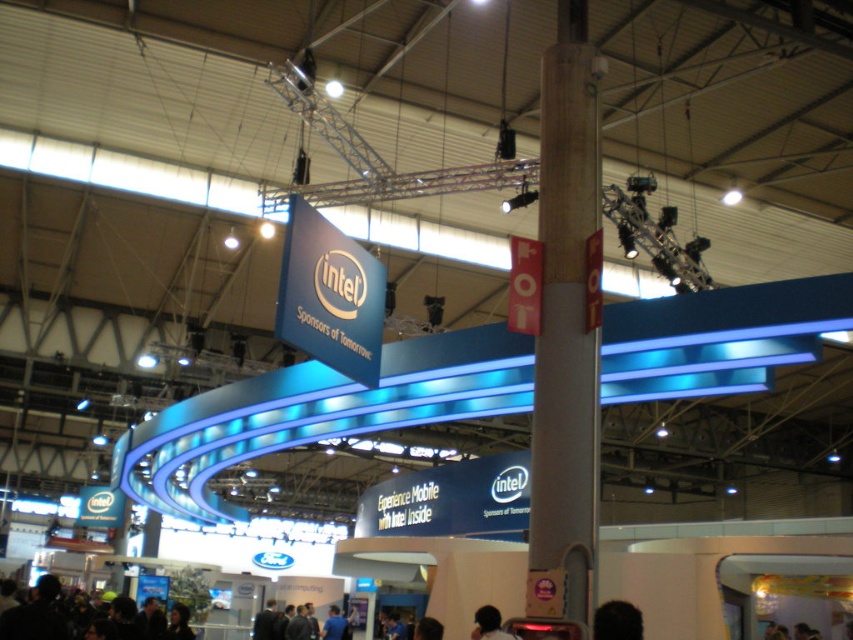
You are standing at the entrance of the exhibition hall and see the wooden pole at center and the dark brown hair at lower center. Which object is closer to you?

The wooden pole at center is closer to you because the dark brown hair at lower center is behind it.

You are standing at the entrance of the exhibition hall and see two points marked in the scene. The first point is at coordinate point (541, 106) and the second is at point (640, 625). Which of these points is closer to you?

Point (541, 106) is closer to you because it is further to the viewer than point (640, 625).

You are an attendee at the Intel expo and you see the dark hair at lower center. Where is the dark hair located in the image?

The dark hair at lower center is located at point (618, 620) in the image.